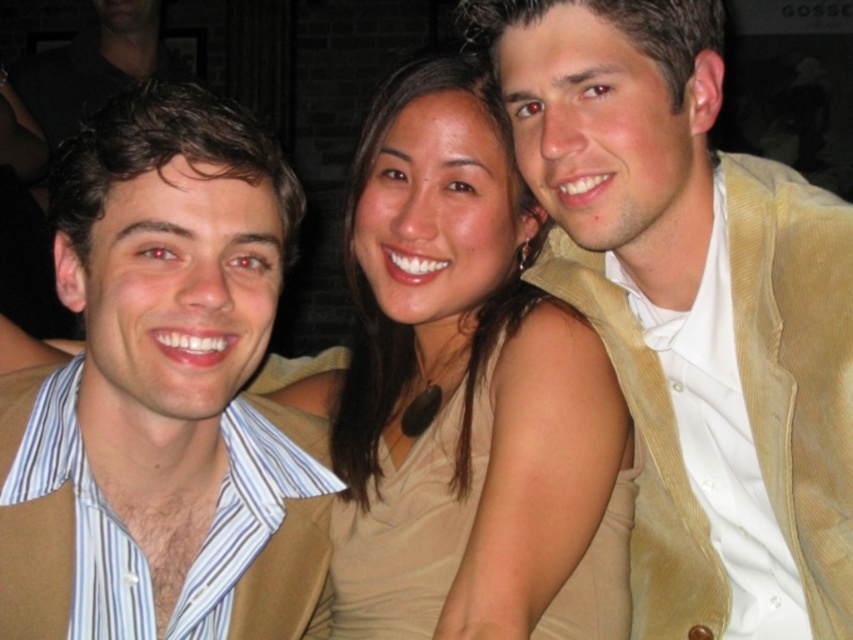
Which is more to the left, tan corduroy vest at center or matte black shirt at left?

Positioned to the left is matte black shirt at left.

Is tan corduroy vest at center shorter than matte black shirt at left?

No.

Is point (799, 444) more distant than point (73, 124)?

No, (799, 444) is closer to viewer.

Locate an element on the screen. The width and height of the screenshot is (853, 640). tan corduroy vest at center is located at coordinates (693, 308).

Between point (792, 385) and point (581, 608), which one is positioned in front?

Point (792, 385)

This screenshot has height=640, width=853. What do you see at coordinates (693, 308) in the screenshot? I see `tan corduroy vest at center` at bounding box center [693, 308].

What are the coordinates of `tan corduroy vest at center` in the screenshot? It's located at (693, 308).

Does tan corduroy vest at center have a greater width compared to matte brown vest at left?

Yes, tan corduroy vest at center is wider than matte brown vest at left.

Can you confirm if tan corduroy vest at center is positioned below matte brown vest at left?

Incorrect, tan corduroy vest at center is not positioned below matte brown vest at left.

Between point (790, 262) and point (248, 636), which one is positioned in front?

Point (790, 262)

Locate an element on the screen. tan corduroy vest at center is located at coordinates (693, 308).